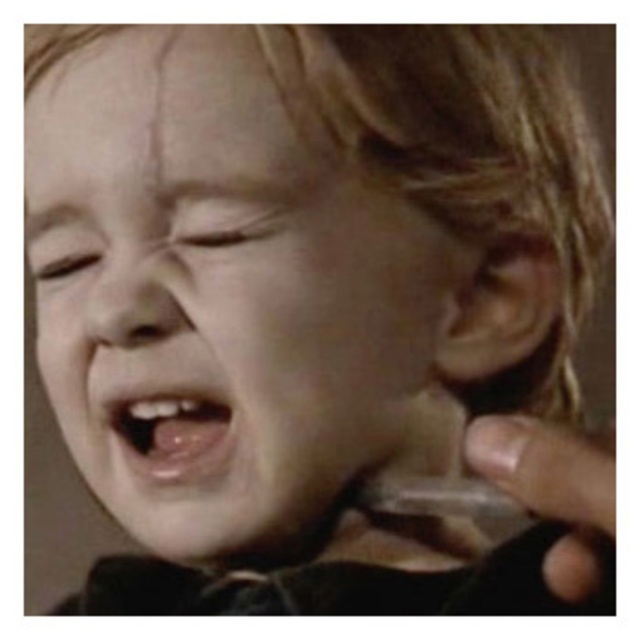
Is smooth skin face at center thinner than pink glossy tongue at center?

No, smooth skin face at center is not thinner than pink glossy tongue at center.

Does smooth skin face at center have a greater height compared to pink glossy tongue at center?

Yes, smooth skin face at center is taller than pink glossy tongue at center.

Image resolution: width=640 pixels, height=640 pixels. Describe the element at coordinates (220, 292) in the screenshot. I see `smooth skin face at center` at that location.

Image resolution: width=640 pixels, height=640 pixels. In order to click on smooth skin face at center in this screenshot , I will do `click(220, 292)`.

How far apart are smooth skin face at center and smooth skin nose at center?

They are 2.20 inches apart.

From the picture: Who is more forward, (116, 44) or (113, 284)?

Point (113, 284) is more forward.

Find the location of a particular element. Image resolution: width=640 pixels, height=640 pixels. smooth skin face at center is located at coordinates (220, 292).

Can you confirm if pink glossy tongue at center is positioned above smooth skin nose at center?

No, pink glossy tongue at center is not above smooth skin nose at center.

Can you confirm if pink glossy tongue at center is positioned to the right of smooth skin nose at center?

Correct, you'll find pink glossy tongue at center to the right of smooth skin nose at center.

Is point (179, 458) farther from viewer compared to point (164, 333)?

Yes, it is behind point (164, 333).

Where is `pink glossy tongue at center`? This screenshot has height=640, width=640. pink glossy tongue at center is located at coordinates (172, 429).